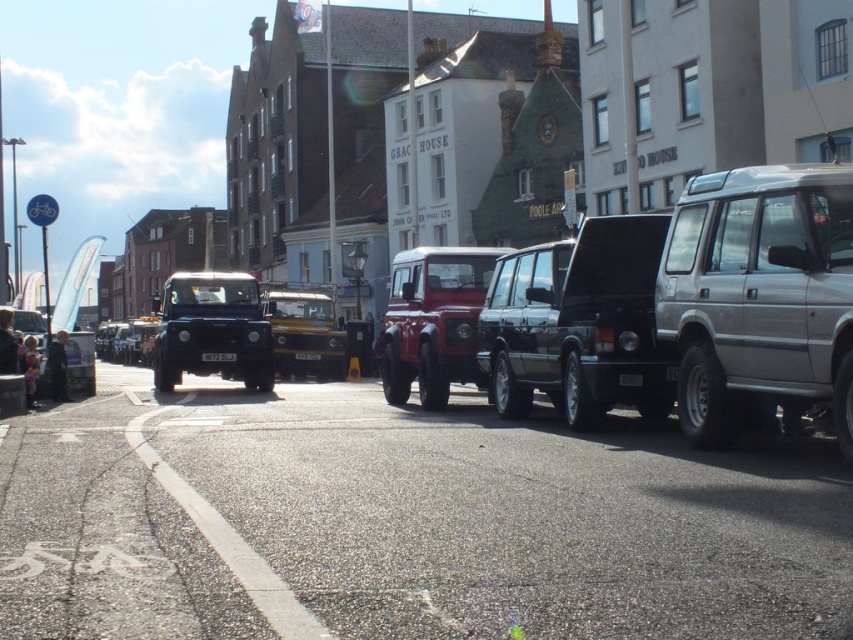
You are a delivery driver who needs to park your matte red suv at center in a spot that has a white plastic license plate at center. Can you safely park your vehicle in this spot without covering the license plate?

The matte red suv at center is already positioned over the white plastic license plate at center, so it is currently covering the license plate. To park safely without covering it, you would need to adjust the vehicle so that the license plate area is clear.

You are a delivery driver who needs to park your delivery van, which is 2 meters wide, in this street scene. Looking at the image, can you determine if the space between the matte red suv at center and the black plastic license plate at center is wide enough for your van?

The matte red suv at center is wider than the black plastic license plate at center. Since the space between them would depend on their widths, but the exact distance isn

You are a delivery driver who needs to park your metallic yellow jeep at center in a spot that can accommodate its width. The parking spot you found has a maximum width limit based on the black plastic license plate at center. Can your jeep fit in this spot?

The metallic yellow jeep at center is wider than the black plastic license plate at center, so it may not fit in a parking spot designed for the license plate size. Check for larger parking spaces.